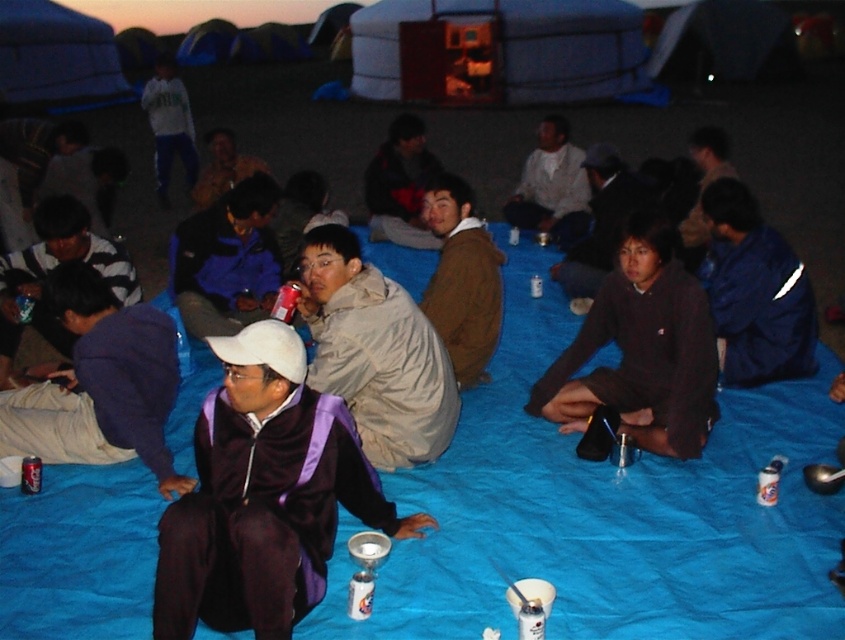
Question: Does purple velour jacket at center have a greater width compared to brown fuzzy jacket at center?

Choices:
 (A) no
 (B) yes

Answer: (B)

Question: Can you confirm if purple fleece jacket at lower left is positioned to the right of camouflage jacket at center?

Choices:
 (A) no
 (B) yes

Answer: (B)

Question: Estimate the real-world distances between objects in this image. Which object is closer to the light brown fabric jacket at center?

Choices:
 (A) dark brown sweater at center
 (B) brown fuzzy jacket at center
 (C) white plastic cup at lower center

Answer: (B)

Question: Among these points, which one is nearest to the camera?

Choices:
 (A) (355, 602)
 (B) (782, 250)
 (C) (227, 349)

Answer: (C)

Question: Is blue fleece jacket at center to the left of light brown fabric jacket at center from the viewer's perspective?

Choices:
 (A) no
 (B) yes

Answer: (B)

Question: Which point appears farthest from the camera in this image?

Choices:
 (A) (254, 422)
 (B) (360, 616)
 (C) (243, 170)

Answer: (C)